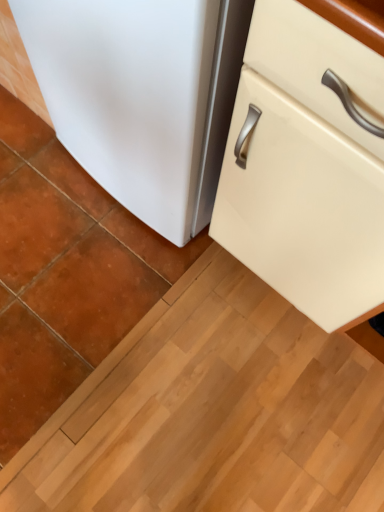
What are the coordinates of `free location to the left of white matte refrigerator at lower left` in the screenshot? It's located at (40, 176).